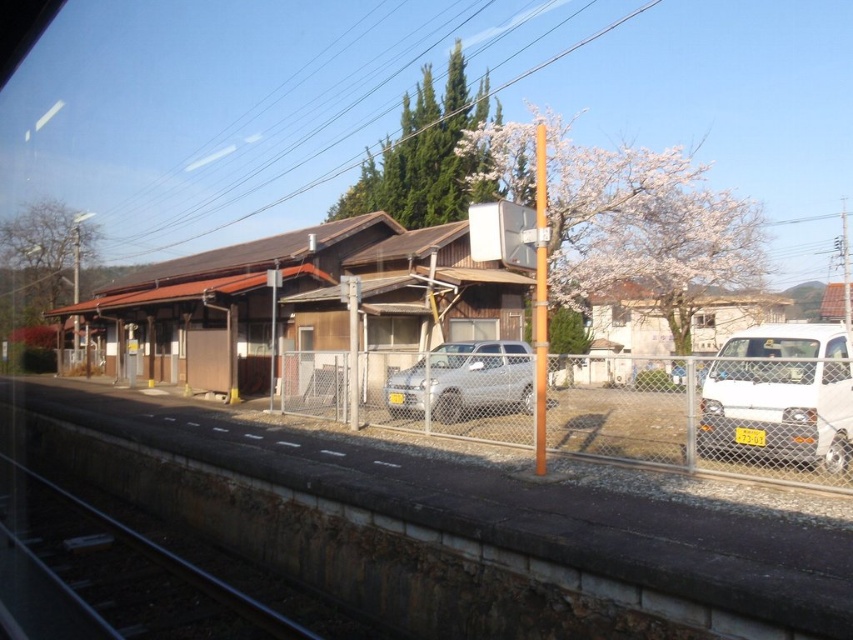
Is point (305, 252) positioned behind point (659, 396)?

That is True.

Is brown wooden building at center closer to the viewer compared to metallic chain-link fence at center?

No, it is not.

The height and width of the screenshot is (640, 853). I want to click on brown wooden building at center, so click(x=303, y=298).

Is brown wooden building at center taller than white matte van at right?

Yes.

Who is more distant from viewer, (271, 310) or (821, 388)?

The point (271, 310) is behind.

Which is behind, point (502, 307) or point (795, 460)?

The point (502, 307) is more distant.

Locate an element on the screen. The width and height of the screenshot is (853, 640). brown wooden building at center is located at coordinates (303, 298).

Between point (733, 440) and point (115, 525), which one is positioned in front?

Point (733, 440)

Can you confirm if white matte van at right is taller than black metal train track at lower left?

Yes, white matte van at right is taller than black metal train track at lower left.

Locate an element on the screen. white matte van at right is located at coordinates (780, 396).